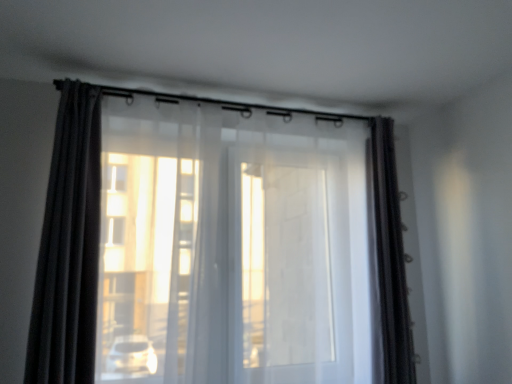
Question: Is satin dark brown curtain at right, which is the 1th curtain in right-to-left order, placed right next to matte black curtain at left, the third curtain viewed from the right?

Choices:
 (A) no
 (B) yes

Answer: (A)

Question: Is matte black curtain at left, which is the first curtain from left to right, a part of satin dark brown curtain at right, the third curtain in the left-to-right sequence?

Choices:
 (A) yes
 (B) no

Answer: (B)

Question: Is satin dark brown curtain at right, which is the 1th curtain in right-to-left order, in front of matte black curtain at left, which is the first curtain from left to right?

Choices:
 (A) yes
 (B) no

Answer: (B)

Question: From a real-world perspective, is satin dark brown curtain at right, the third curtain in the left-to-right sequence, over matte black curtain at left, the third curtain viewed from the right?

Choices:
 (A) no
 (B) yes

Answer: (A)

Question: Is satin dark brown curtain at right, the third curtain in the left-to-right sequence, to the left of matte black curtain at left, which is the first curtain from left to right, from the viewer's perspective?

Choices:
 (A) no
 (B) yes

Answer: (A)

Question: From the image's perspective, relative to matte black curtain at left, which is the first curtain from left to right, is satin dark brown curtain at right, the third curtain in the left-to-right sequence, above or below?

Choices:
 (A) above
 (B) below

Answer: (B)

Question: From a real-world perspective, is satin dark brown curtain at right, the third curtain in the left-to-right sequence, above or below matte black curtain at left, the third curtain viewed from the right?

Choices:
 (A) below
 (B) above

Answer: (A)

Question: Is point (380, 125) closer or farther from the camera than point (87, 253)?

Choices:
 (A) closer
 (B) farther

Answer: (B)

Question: Would you say satin dark brown curtain at right, which is the 1th curtain in right-to-left order, is to the left or to the right of matte black curtain at left, the third curtain viewed from the right, in the picture?

Choices:
 (A) left
 (B) right

Answer: (B)

Question: Considering the positions of transparent fabric curtain at center, which ranks as the second curtain in left-to-right order, and satin dark brown curtain at right, which is the 1th curtain in right-to-left order, in the image, is transparent fabric curtain at center, which ranks as the second curtain in left-to-right order, taller or shorter than satin dark brown curtain at right, which is the 1th curtain in right-to-left order,?

Choices:
 (A) tall
 (B) short

Answer: (A)

Question: Relative to satin dark brown curtain at right, which is the 1th curtain in right-to-left order, is transparent fabric curtain at center, the 2th curtain from the right, in front or behind?

Choices:
 (A) behind
 (B) front

Answer: (B)

Question: In terms of size, does transparent fabric curtain at center, which ranks as the second curtain in left-to-right order, appear bigger or smaller than satin dark brown curtain at right, the third curtain in the left-to-right sequence?

Choices:
 (A) big
 (B) small

Answer: (A)

Question: Is transparent fabric curtain at center, which ranks as the second curtain in left-to-right order, inside the boundaries of satin dark brown curtain at right, the third curtain in the left-to-right sequence, or outside?

Choices:
 (A) outside
 (B) inside

Answer: (A)

Question: In the image, is transparent fabric curtain at center, the 2th curtain from the right, on the left side or the right side of matte black curtain at left, the third curtain viewed from the right?

Choices:
 (A) left
 (B) right

Answer: (B)

Question: Is transparent fabric curtain at center, which ranks as the second curtain in left-to-right order, situated inside matte black curtain at left, the third curtain viewed from the right, or outside?

Choices:
 (A) inside
 (B) outside

Answer: (B)